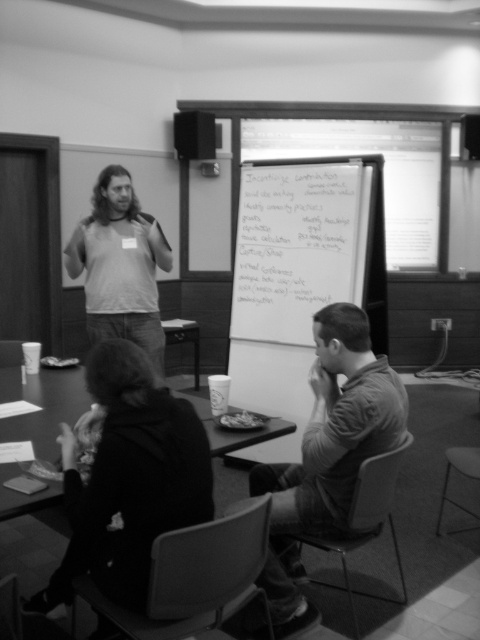
Describe the element at coordinates (327, 454) in the screenshot. I see `matte gray shirt at center` at that location.

Which is in front, point (344, 310) or point (327, 188)?

Point (344, 310) is more forward.

Where is `matte gray shirt at center`? Image resolution: width=480 pixels, height=640 pixels. matte gray shirt at center is located at coordinates (327, 454).

Identify the location of white paper at center. The height and width of the screenshot is (640, 480). (300, 243).

Based on the photo, which is more to the left, matte gray tank top at center or smooth plastic table at lower center?

smooth plastic table at lower center

Between point (122, 260) and point (41, 412), which one is positioned behind?

Positioned behind is point (122, 260).

Is point (169, 257) closer to viewer compared to point (57, 426)?

No, it is behind (57, 426).

Locate an element on the screen. The width and height of the screenshot is (480, 640). matte gray tank top at center is located at coordinates (120, 266).